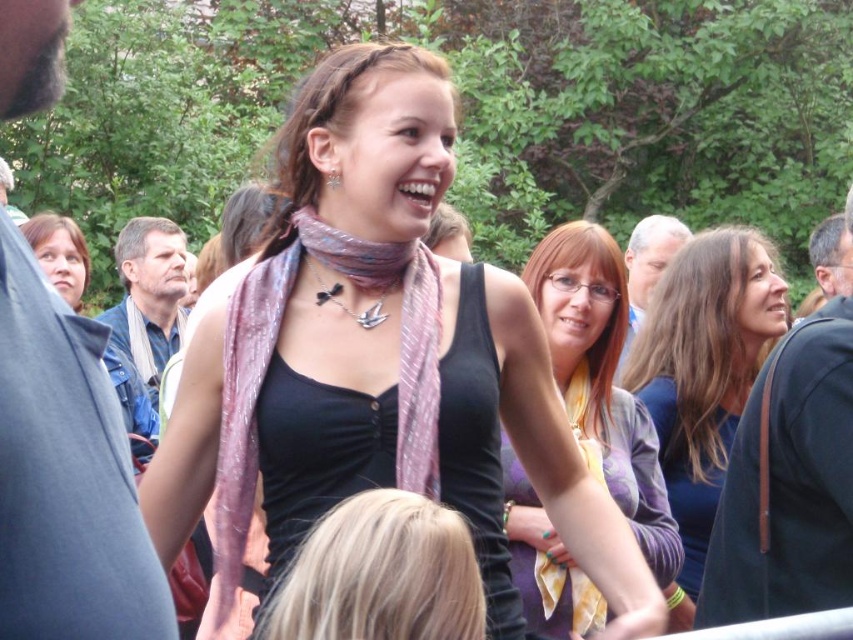
Question: Which object appears closest to the camera in this image?

Choices:
 (A) dark blue shirt at right
 (B) purple satin dress at upper right
 (C) blue denim jacket at upper left
 (D) blonde hair at lower center

Answer: (C)

Question: Does blonde hair at lower center lie behind matte black scarf at upper left?

Choices:
 (A) yes
 (B) no

Answer: (B)

Question: Estimate the real-world distances between objects in this image. Which object is farther from the pink silk scarf at center?

Choices:
 (A) dark blue fabric at center
 (B) matte black scarf at upper left
 (C) purple satin dress at upper right
 (D) blonde hair at lower center

Answer: (B)

Question: Does blue denim jacket at upper left have a smaller size compared to yellow fabric scarf at center?

Choices:
 (A) no
 (B) yes

Answer: (B)

Question: Which point is closer to the camera?

Choices:
 (A) smooth gray hair at upper center
 (B) yellow fabric scarf at center
 (C) blonde hair at lower center
 (D) pink silk scarf at center

Answer: (C)

Question: Is blue denim jacket at upper left below blonde hair at lower center?

Choices:
 (A) no
 (B) yes

Answer: (A)